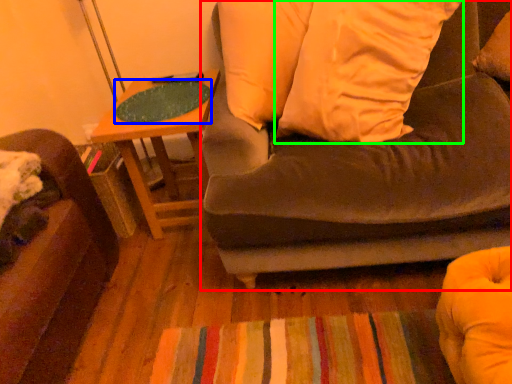
Question: Estimate the real-world distances between objects in this image. Which object is farther from studio couch (highlighted by a red box), table top (highlighted by a blue box) or pillow (highlighted by a green box)?

Choices:
 (A) table top
 (B) pillow

Answer: (A)